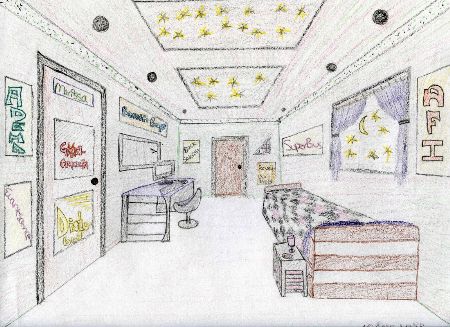
The image size is (450, 327). I want to click on monitor, so click(x=166, y=165).